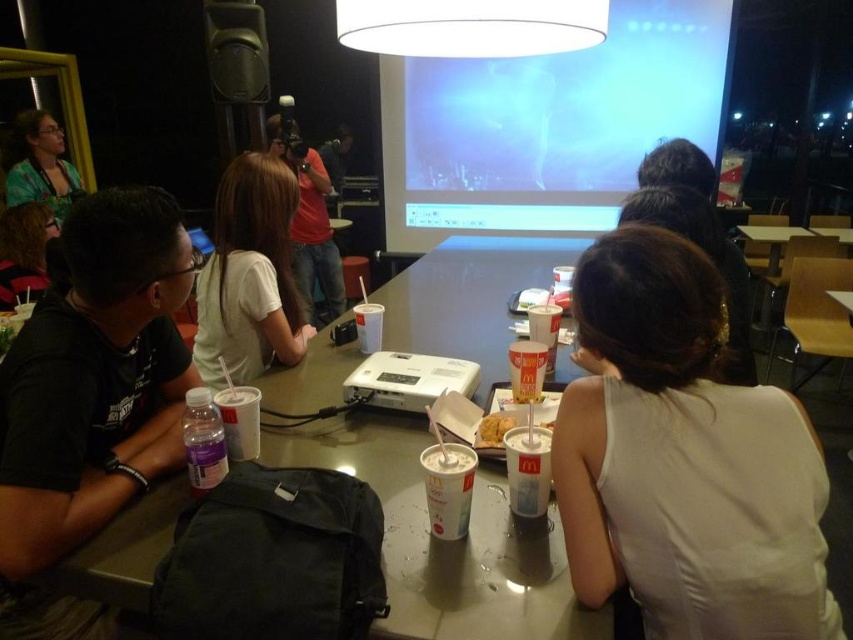
Question: Is white fabric shirt at center in front of black matte shirt at left?

Choices:
 (A) yes
 (B) no

Answer: (A)

Question: Based on their relative distances, which object is farther from the matte white screen at upper center?

Choices:
 (A) white paper cup at center
 (B) matte black camera at upper center
 (C) matte red shirt at center

Answer: (A)

Question: From the image, what is the correct spatial relationship of white fabric shirt at center in relation to green textured shirt at upper left?

Choices:
 (A) left
 (B) right

Answer: (B)

Question: Does dark brown hair at center come in front of clear plastic bottle at center?

Choices:
 (A) yes
 (B) no

Answer: (A)

Question: Which point is closer to the camera?

Choices:
 (A) (99, 301)
 (B) (13, 259)
 (C) (654, 12)

Answer: (A)

Question: Estimate the real-world distances between objects in this image. Which object is closer to the white paper cup at center?

Choices:
 (A) black matte shirt at left
 (B) white plastic projector at center
 (C) golden crispy chicken at center

Answer: (C)